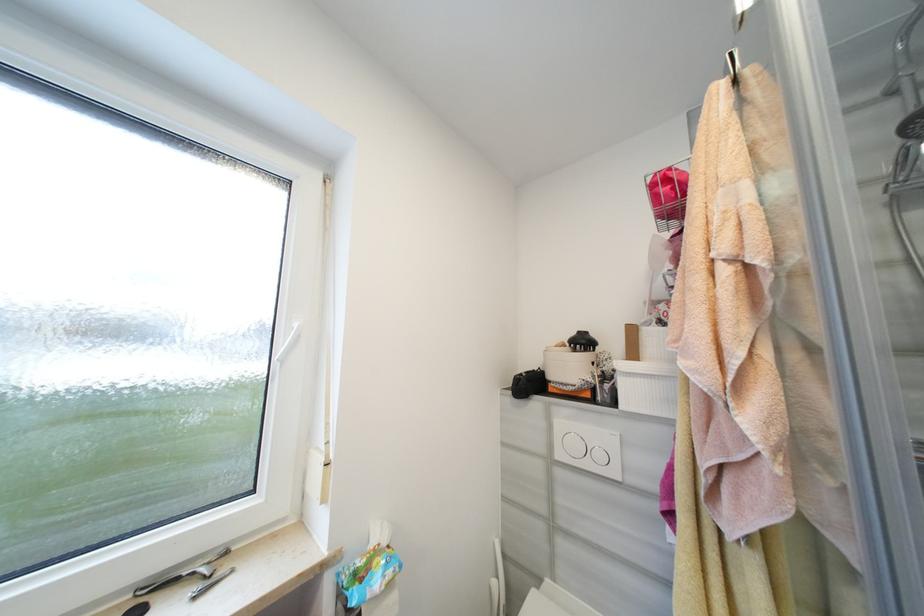
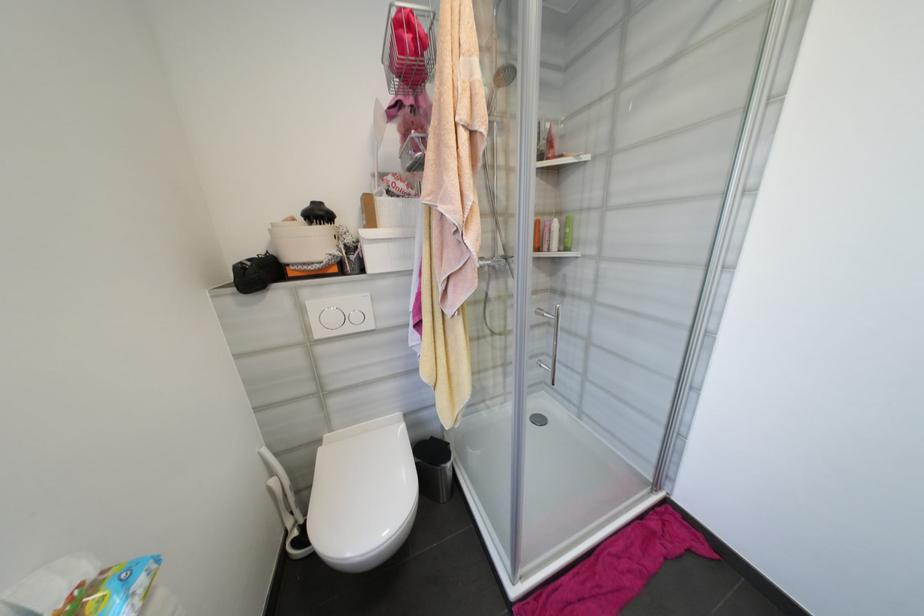
Where in the second image is the point corresponding to (x=604, y=456) from the first image?

(361, 318)